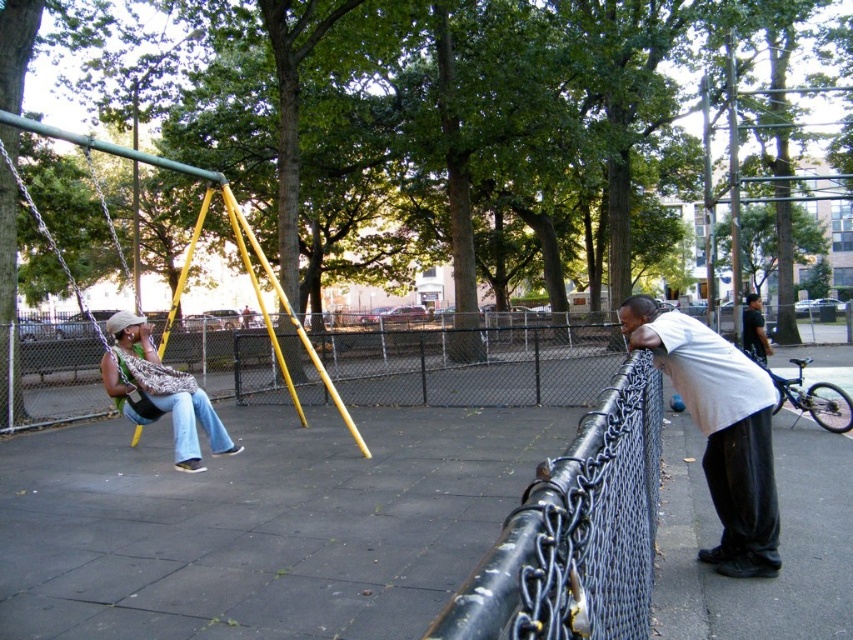
From the picture: Can you confirm if matte green swing at left is smaller than matte black swing at left?

Yes.

Does matte green swing at left lie behind matte black swing at left?

Yes.

I want to click on matte green swing at left, so click(160, 392).

Is point (112, 316) closer to camera compared to point (757, 296)?

Yes, point (112, 316) is in front of point (757, 296).

Measure the distance between matte green swing at left and camera.

matte green swing at left and camera are 22.05 feet apart.

Between point (128, 396) and point (762, 328), which one is positioned behind?

The point (762, 328) is behind.

In order to click on matte green swing at left in this screenshot , I will do `click(160, 392)`.

Is point (132, 438) positioned after point (753, 332)?

No, it is in front of (753, 332).

Is matte black swing at left closer to camera compared to dark green shirt at right?

Yes, matte black swing at left is closer to the viewer.

Image resolution: width=853 pixels, height=640 pixels. Describe the element at coordinates (55, 250) in the screenshot. I see `matte black swing at left` at that location.

Locate an element on the screen. matte black swing at left is located at coordinates (55, 250).